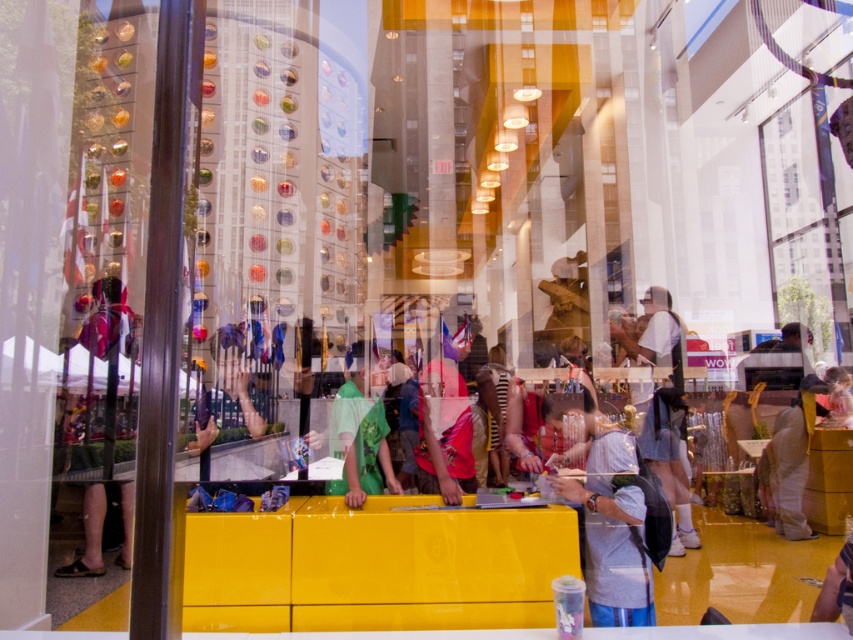
You are standing in the LEGO store and want to pick up an item located at point A and another at point B. If point A corresponds to point (x=618, y=442) and point B to (x=793, y=488), which point is closer to you?

Point A, which is point (x=618, y=442), is closer to you than point B, point (x=793, y=488).

You are standing in the LEGO store and want to reach a point that is exactly 13.05 feet away from where you are currently standing. Can you confirm if the point at coordinates point (352, 461) is the correct location to reach?

Yes, the point at coordinates point (352, 461) is exactly 13.05 feet away from the viewer, so reaching that point would satisfy the requirement.

You are a customer in the LEGO store and want to place your matte gray backpack at lower right on the counter next to your light brown fabric pants at center. The counter has a width of 1 meter. Will the backpack fit on the counter without overlapping the pants?

The matte gray backpack at lower right is narrower than the light brown fabric pants at center. Since the counter is 1 meter wide, the backpack will fit without overlapping the pants as long as there is enough space allocated for both items.